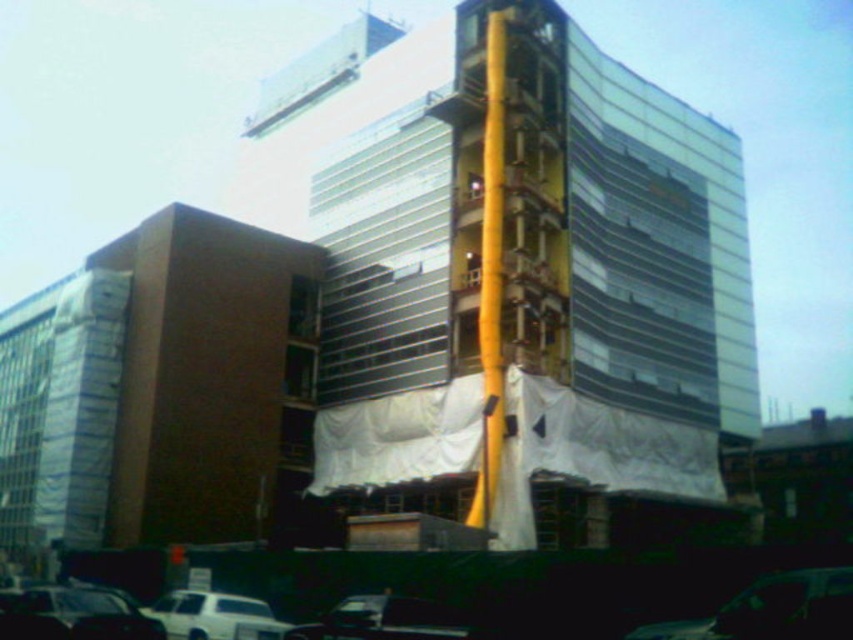
Question: Can you confirm if yellow wood pole at center is positioned to the right of shiny black car at center?

Choices:
 (A) yes
 (B) no

Answer: (B)

Question: Among these objects, which one is nearest to the camera?

Choices:
 (A) metallic silver car at lower center
 (B) yellow wood pole at center
 (C) yellow metallic tower at center

Answer: (A)

Question: Is yellow wood pole at center below shiny black car at center?

Choices:
 (A) yes
 (B) no

Answer: (B)

Question: Which point appears closest to the camera in this image?

Choices:
 (A) (628, 211)
 (B) (54, 611)
 (C) (340, 604)

Answer: (B)

Question: Which object appears farthest from the camera in this image?

Choices:
 (A) metallic silver car at lower center
 (B) shiny black car at center
 (C) white matte car at lower center

Answer: (C)

Question: Does shiny black car at lower left lie in front of metallic silver car at lower center?

Choices:
 (A) yes
 (B) no

Answer: (A)